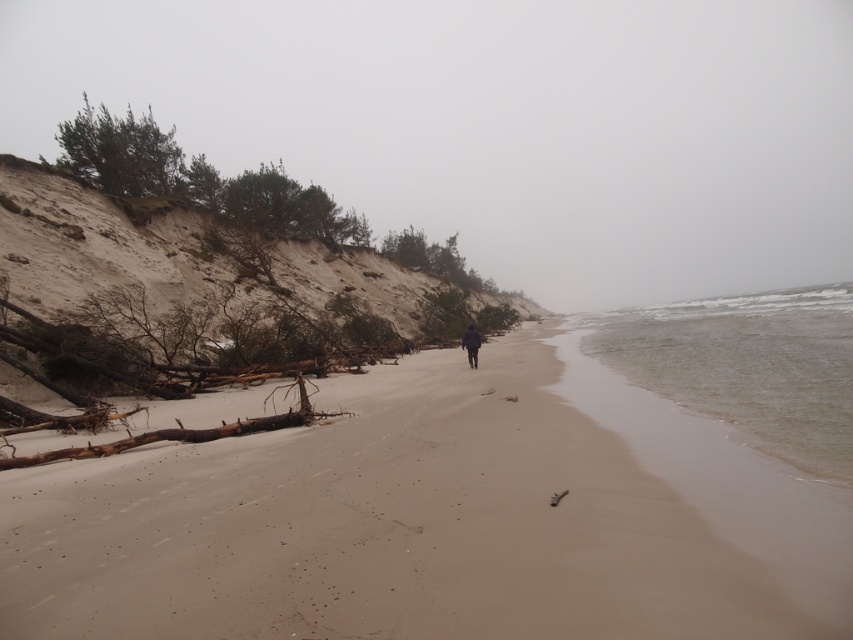
Question: Which of the following is the closest to the observer?

Choices:
 (A) clear water at lower right
 (B) sandy beach at center
 (C) dark matte jacket at center

Answer: (B)

Question: Does sandy beach at center come behind dark matte jacket at center?

Choices:
 (A) yes
 (B) no

Answer: (B)

Question: Is the position of clear water at lower right less distant than that of dark matte jacket at center?

Choices:
 (A) yes
 (B) no

Answer: (A)

Question: Which object is the farthest from the dark matte jacket at center?

Choices:
 (A) sandy beach at center
 (B) clear water at lower right

Answer: (B)

Question: Which object is the farthest from the clear water at lower right?

Choices:
 (A) sandy beach at center
 (B) dark matte jacket at center

Answer: (B)

Question: Does clear water at lower right have a greater width compared to dark matte jacket at center?

Choices:
 (A) yes
 (B) no

Answer: (A)